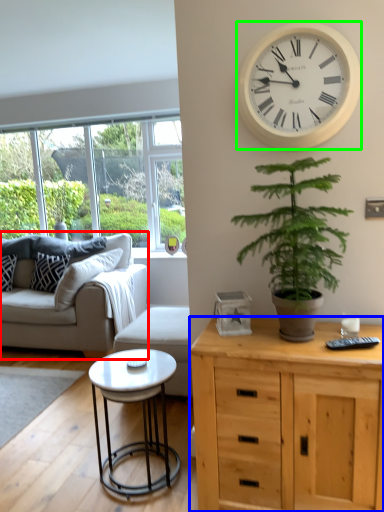
Question: Which object is the closest to the studio couch (highlighted by a red box)? Choose among these: cabinetry (highlighted by a blue box) or wall clock (highlighted by a green box).

Choices:
 (A) cabinetry
 (B) wall clock

Answer: (A)